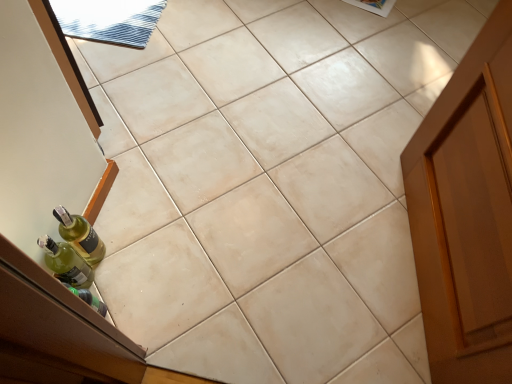
Locate an element on the screen. The image size is (512, 384). free space to the right of green glass bottle at left, the first bottle in the bottom-to-top sequence is located at coordinates (143, 287).